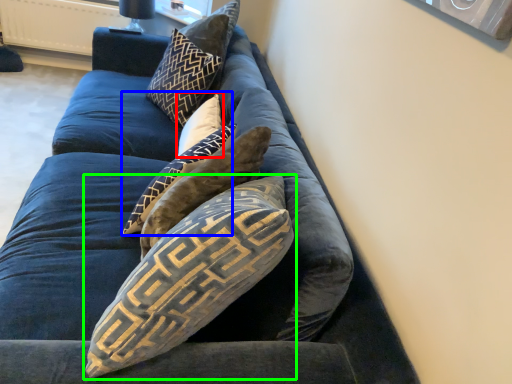
Question: Which is nearer to the pillow (highlighted by a red box)? pillow (highlighted by a blue box) or pillow (highlighted by a green box).

Choices:
 (A) pillow
 (B) pillow

Answer: (A)